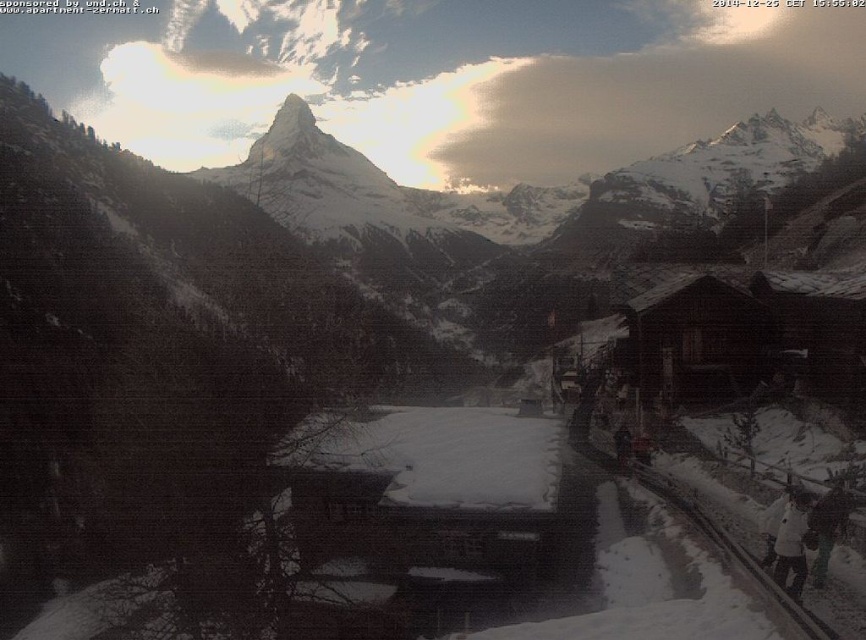
You are standing at the center of the village and want to take a train. Where should you look to find the dark gray metal train track at lower right?

The dark gray metal train track at lower right is located at the lower right of the image, specifically at the 2D coordinates point (735, 556).

You are a hiker planning to walk from the wooden cabin at right to the dark gray metal train track at lower right. Which direction should you head to reach the train track from the cabin?

The wooden cabin at right is positioned on the right side of dark gray metal train track at lower right, so to reach the train track from the cabin, you should head to the left.